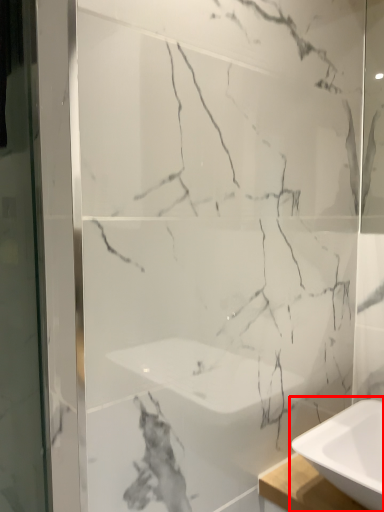
Question: From the image's perspective, what is the correct spatial relationship of sink (annotated by the red box) in relation to screen door?

Choices:
 (A) below
 (B) above

Answer: (A)